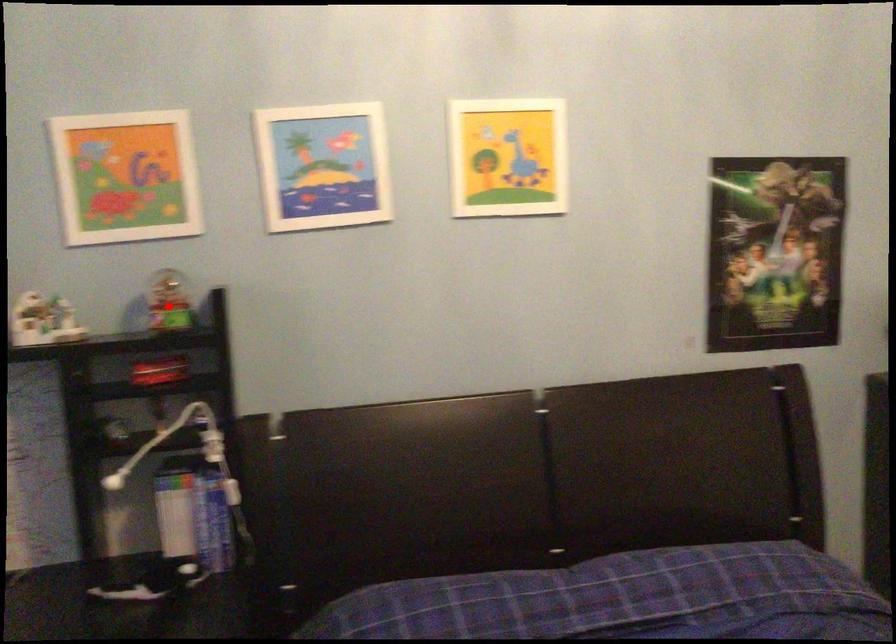
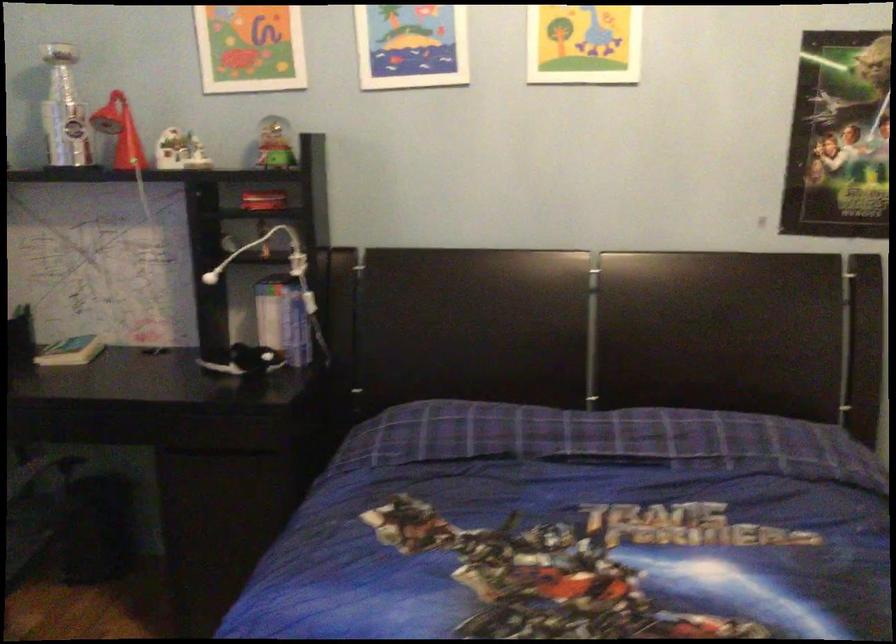
Question: I am providing you with two images of the same scene from different viewpoints. A red point is shown in image1. For the corresponding object point in image2, is it positioned nearer or farther from the camera?

Choices:
 (A) Nearer
 (B) Farther

Answer: (B)